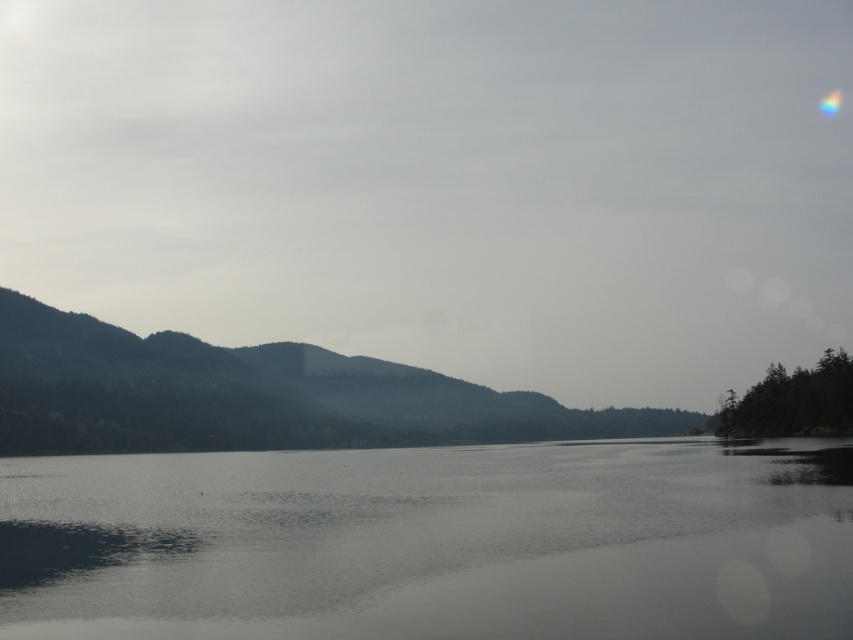
Can you confirm if transparent water at center is taller than green matte forest at left?

In fact, transparent water at center may be shorter than green matte forest at left.

Is point (503, 452) closer to camera compared to point (381, 412)?

Yes.

Where is `transparent water at center`? transparent water at center is located at coordinates (431, 541).